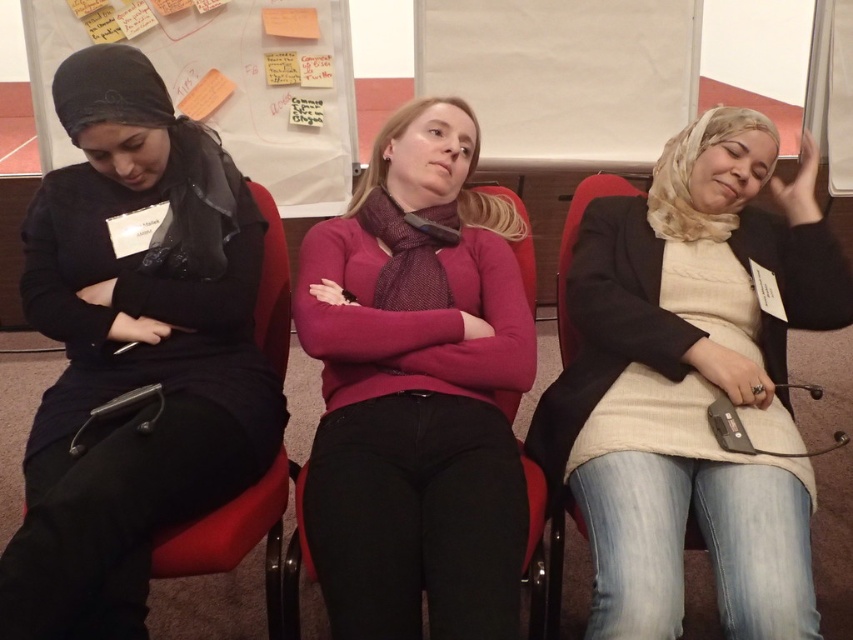
Question: Which of the following is the closest to the observer?

Choices:
 (A) light beige sweater at center
 (B) matte pink sweater at center
 (C) white paperboard at upper center

Answer: (B)

Question: Which object is farther from the camera taking this photo?

Choices:
 (A) matte pink sweater at center
 (B) light beige sweater at center
 (C) matte black hoodie at left
 (D) white paperboard at upper center

Answer: (D)

Question: Which object appears closest to the camera in this image?

Choices:
 (A) matte pink sweater at center
 (B) light beige sweater at center
 (C) matte black hoodie at left

Answer: (A)

Question: Can you confirm if light beige sweater at center is positioned above matte pink sweater at center?

Choices:
 (A) yes
 (B) no

Answer: (B)

Question: Is light beige sweater at center above white paperboard at upper center?

Choices:
 (A) no
 (B) yes

Answer: (A)

Question: Considering the relative positions of light beige sweater at center and matte pink sweater at center in the image provided, where is light beige sweater at center located with respect to matte pink sweater at center?

Choices:
 (A) right
 (B) left

Answer: (A)